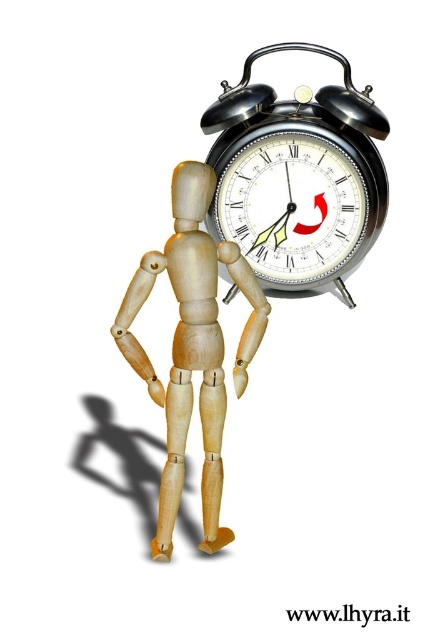
Consider the image. Between black metal alarm clock at upper right and metallic silver clock at center, which one has more height?

Standing taller between the two is black metal alarm clock at upper right.

Describe the element at coordinates (297, 177) in the screenshot. I see `black metal alarm clock at upper right` at that location.

Locate an element on the screen. black metal alarm clock at upper right is located at coordinates (297, 177).

Image resolution: width=438 pixels, height=640 pixels. In order to click on black metal alarm clock at upper right in this screenshot , I will do point(297,177).

Looking at this image, is black metal alarm clock at upper right to the right of wooden mannequin at center from the viewer's perspective?

Yes, black metal alarm clock at upper right is to the right of wooden mannequin at center.

Who is more distant from viewer, (x=318, y=272) or (x=219, y=433)?

The point (x=318, y=272) is behind.

Find the location of a particular element. This screenshot has width=438, height=640. black metal alarm clock at upper right is located at coordinates (297, 177).

Can you confirm if wooden mannequin at center is taller than metallic silver clock at center?

Indeed, wooden mannequin at center has a greater height compared to metallic silver clock at center.

Which is behind, point (216, 545) or point (286, 244)?

The point (286, 244) is behind.

The height and width of the screenshot is (640, 438). Find the location of `wooden mannequin at center`. wooden mannequin at center is located at coordinates (191, 348).